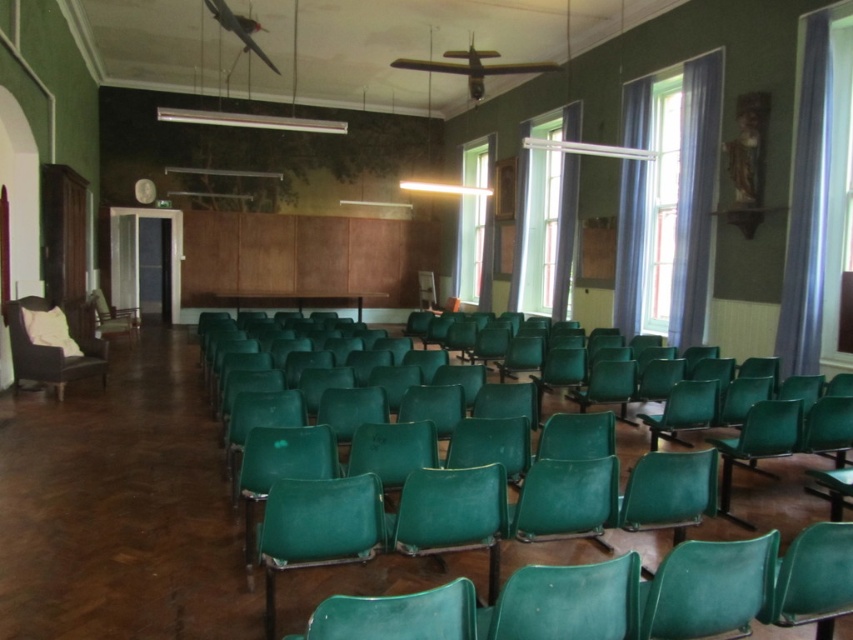
Who is taller, velvet brown armchair at left or green plastic chair at left?

velvet brown armchair at left is taller.

Locate an element on the screen. velvet brown armchair at left is located at coordinates (49, 352).

Who is shorter, matte green armchair at center or velvet brown armchair at left?

With less height is matte green armchair at center.

How far apart are matte green armchair at center and velvet brown armchair at left?

matte green armchair at center and velvet brown armchair at left are 5.45 meters apart from each other.

What do you see at coordinates (769, 500) in the screenshot? I see `matte green armchair at center` at bounding box center [769, 500].

At what (x,y) coordinates should I click in order to perform the action: click on matte green armchair at center. Please return your answer as a coordinate pair (x, y). The width and height of the screenshot is (853, 640). Looking at the image, I should click on (769, 500).

Find the location of a particular element. Image resolution: width=853 pixels, height=640 pixels. matte green armchair at center is located at coordinates (769, 500).

Does matte green armchair at center have a greater width compared to green plastic chair at left?

No, matte green armchair at center is not wider than green plastic chair at left.

At what (x,y) coordinates should I click in order to perform the action: click on matte green armchair at center. Please return your answer as a coordinate pair (x, y). Image resolution: width=853 pixels, height=640 pixels. Looking at the image, I should click on (769, 500).